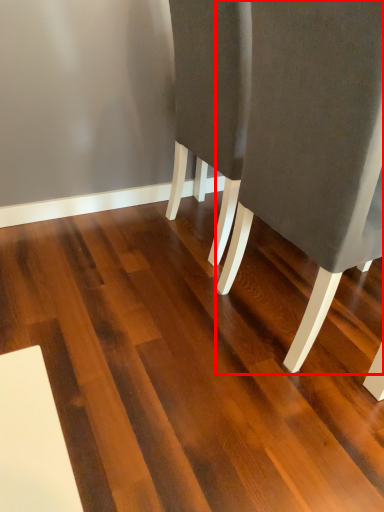
Question: In this image, where is chair (annotated by the red box) located relative to hardwood?

Choices:
 (A) left
 (B) right

Answer: (B)